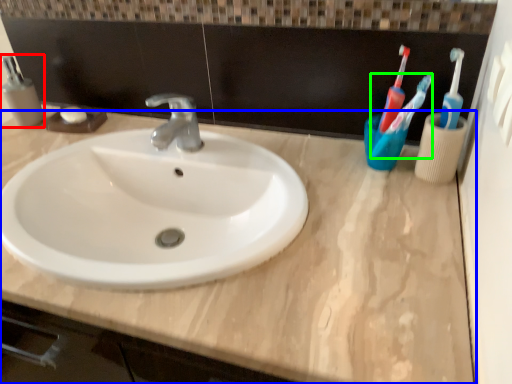
Question: Estimate the real-world distances between objects in this image. Which object is farther from mouthwash (highlighted by a red box), counter top (highlighted by a blue box) or toothbrush (highlighted by a green box)?

Choices:
 (A) counter top
 (B) toothbrush

Answer: (B)